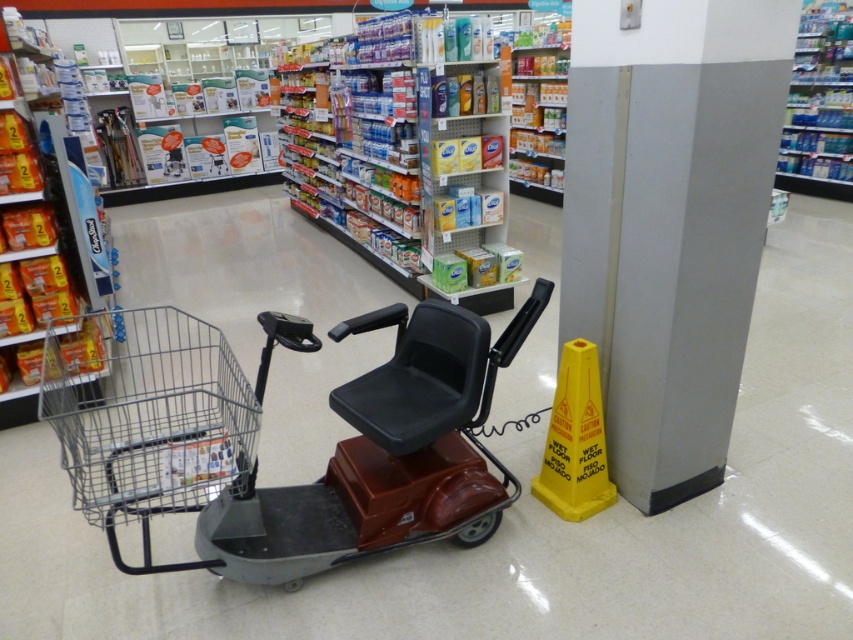
Question: Which point appears closest to the camera in this image?

Choices:
 (A) (769, 84)
 (B) (415, 456)

Answer: (A)

Question: Can you confirm if gray smooth pillar at right is positioned to the right of metallic gray shopping cart at center?

Choices:
 (A) no
 (B) yes

Answer: (B)

Question: Is gray smooth pillar at right wider than metallic gray shopping cart at center?

Choices:
 (A) no
 (B) yes

Answer: (A)

Question: Does gray smooth pillar at right have a greater width compared to metallic gray shopping cart at center?

Choices:
 (A) yes
 (B) no

Answer: (B)

Question: Which point is farther to the camera?

Choices:
 (A) (515, 323)
 (B) (747, 109)

Answer: (A)